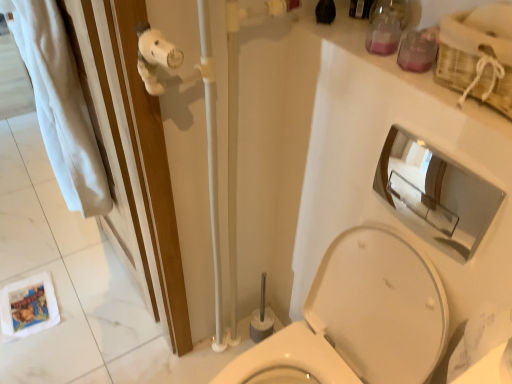
Question: Is white glossy toilet at center positioned in front of pink glass jar at upper right, acting as the 1th toiletry starting from the top?

Choices:
 (A) yes
 (B) no

Answer: (A)

Question: Does white glossy toilet at center have a lesser width compared to pink glass jar at upper right, arranged as the first toiletry when viewed from the back?

Choices:
 (A) yes
 (B) no

Answer: (B)

Question: Is white glossy toilet at center smaller than pink glass jar at upper right, arranged as the first toiletry when viewed from the back?

Choices:
 (A) yes
 (B) no

Answer: (B)

Question: From the image's perspective, is white glossy toilet at center located above pink glass jar at upper right, arranged as the first toiletry when viewed from the back?

Choices:
 (A) no
 (B) yes

Answer: (A)

Question: Considering the relative sizes of white glossy toilet at center and pink glass jar at upper right, acting as the 1th toiletry starting from the top, in the image provided, is white glossy toilet at center taller than pink glass jar at upper right, acting as the 1th toiletry starting from the top,?

Choices:
 (A) no
 (B) yes

Answer: (B)

Question: Is point (423, 31) closer or farther from the camera than point (237, 114)?

Choices:
 (A) farther
 (B) closer

Answer: (B)

Question: In terms of width, does translucent plastic container at upper right, which is the 2th toiletry from back to front, look wider or thinner when compared to white plush toy at upper left?

Choices:
 (A) wide
 (B) thin

Answer: (B)

Question: Considering the positions of translucent plastic container at upper right, which is the 2th toiletry from back to front, and white plush toy at upper left in the image, is translucent plastic container at upper right, which is the 2th toiletry from back to front, bigger or smaller than white plush toy at upper left?

Choices:
 (A) small
 (B) big

Answer: (A)

Question: From a real-world perspective, relative to white plush toy at upper left, is translucent plastic container at upper right, which is the 2th toiletry from back to front, vertically above or below?

Choices:
 (A) above
 (B) below

Answer: (A)

Question: From the image's perspective, is pink glass jar at upper right, placed as the second toiletry when sorted from bottom to top, located above or below white glossy toilet at center?

Choices:
 (A) below
 (B) above

Answer: (B)

Question: Is point (376, 34) closer or farther from the camera than point (384, 365)?

Choices:
 (A) farther
 (B) closer

Answer: (B)

Question: In terms of height, does pink glass jar at upper right, arranged as the first toiletry when viewed from the back, look taller or shorter compared to white glossy toilet at center?

Choices:
 (A) tall
 (B) short

Answer: (B)

Question: Relative to white glossy toilet at center, is pink glass jar at upper right, arranged as the first toiletry when viewed from the back, in front or behind?

Choices:
 (A) behind
 (B) front

Answer: (A)

Question: From their relative heights in the image, would you say white plush toy at upper left is taller or shorter than white glossy toilet at center?

Choices:
 (A) tall
 (B) short

Answer: (A)

Question: Looking at the image, does white plush toy at upper left seem bigger or smaller compared to white glossy toilet at center?

Choices:
 (A) big
 (B) small

Answer: (B)